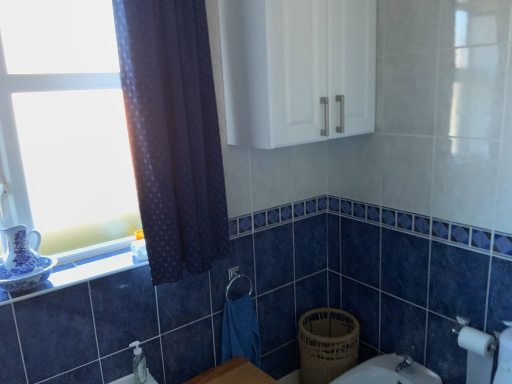
Question: Can you confirm if white matte toilet paper at lower right is taller than white glass window at left?

Choices:
 (A) no
 (B) yes

Answer: (A)

Question: Is white glass window at left inside white matte toilet paper at lower right?

Choices:
 (A) yes
 (B) no

Answer: (B)

Question: Is white matte toilet paper at lower right far away from white glass window at left?

Choices:
 (A) no
 (B) yes

Answer: (B)

Question: Does white matte toilet paper at lower right appear on the left side of white glass window at left?

Choices:
 (A) no
 (B) yes

Answer: (A)

Question: From a real-world perspective, is white matte toilet paper at lower right on top of white glass window at left?

Choices:
 (A) no
 (B) yes

Answer: (A)

Question: Is white matte toilet paper at lower right closer to camera compared to white glass window at left?

Choices:
 (A) no
 (B) yes

Answer: (A)

Question: Is white glossy window sill at lower left touching dark blue sheer curtain at left?

Choices:
 (A) no
 (B) yes

Answer: (A)

Question: From the image's perspective, is white glossy window sill at lower left beneath dark blue sheer curtain at left?

Choices:
 (A) yes
 (B) no

Answer: (A)

Question: Is white glossy window sill at lower left positioned with its back to dark blue sheer curtain at left?

Choices:
 (A) no
 (B) yes

Answer: (A)

Question: Does white glossy window sill at lower left have a smaller size compared to dark blue sheer curtain at left?

Choices:
 (A) yes
 (B) no

Answer: (A)

Question: Can you confirm if white glossy window sill at lower left is bigger than dark blue sheer curtain at left?

Choices:
 (A) yes
 (B) no

Answer: (B)

Question: Is white glossy window sill at lower left at the right side of dark blue sheer curtain at left?

Choices:
 (A) yes
 (B) no

Answer: (B)

Question: Is dark blue sheer curtain at left a part of blue fabric hand towel at lower center?

Choices:
 (A) yes
 (B) no

Answer: (B)